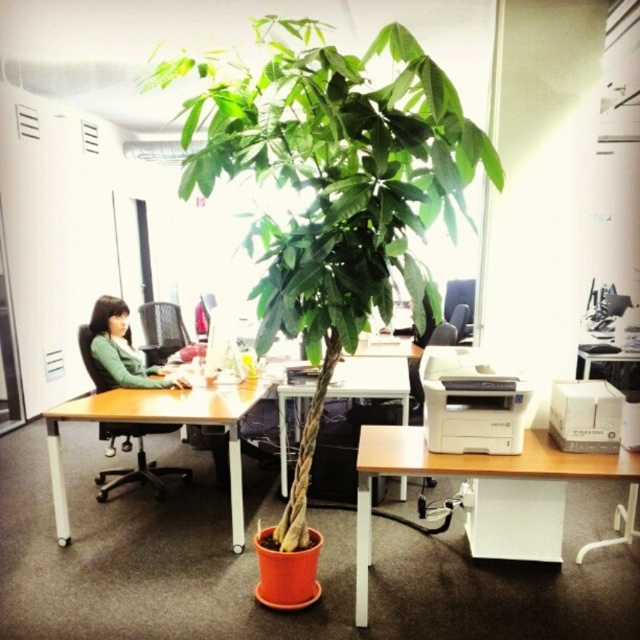
Question: Does white plastic printer at lower center have a smaller size compared to white matte printer at right?

Choices:
 (A) no
 (B) yes

Answer: (A)

Question: Can you confirm if green leafy plant at center is bigger than matte green sweater at left?

Choices:
 (A) no
 (B) yes

Answer: (B)

Question: Is white plastic printer at lower center to the left of white matte printer at right from the viewer's perspective?

Choices:
 (A) yes
 (B) no

Answer: (B)

Question: Which point is closer to the camera taking this photo?

Choices:
 (A) (182, 380)
 (B) (248, 161)
 (C) (362, 440)

Answer: (B)

Question: Which object appears farthest from the camera in this image?

Choices:
 (A) wooden table at center
 (B) white matte printer at right
 (C) matte green sweater at left

Answer: (C)

Question: Which point is farther from the camera taking this photo?

Choices:
 (A) (236, 417)
 (B) (451, 429)
 (C) (147, 381)

Answer: (C)